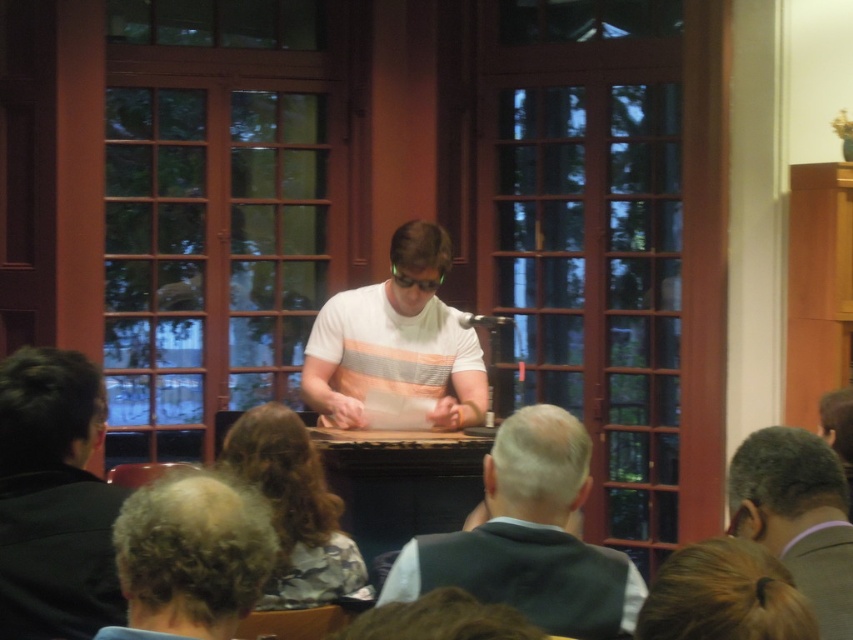
You are standing in the room where the person is demonstrating something at the table. You want to take a photo of the demonstration from a position that is exactly 5 meters away from the point where the demonstration is happening. Is the point at coordinates point (381, 316) the correct location to stand?

Yes, the point at coordinates point (381, 316) is the correct location because the distance from the viewer to this point is exactly 5.04 meters, which is just over 5 meters, so it meets the requirement.

You are organizing a photo shoot and need to place a small prop between the black leather jacket at left and the curly hair at lower left. Which object should the prop be placed closer to if you want it to appear balanced visually?

The prop should be placed closer to the curly hair at lower left because the black leather jacket at left has a larger size, so balancing the visual weight would require placing the prop nearer to the smaller object.

You are organizing a small event and need to determine seating arrangements based on the attendees in the image. The black leather jacket at left and the blonde hair at lower right are two attendees. Which attendee requires more space due to their clothing size?

The black leather jacket at left requires more space because it is larger in size than the blonde hair at lower right.